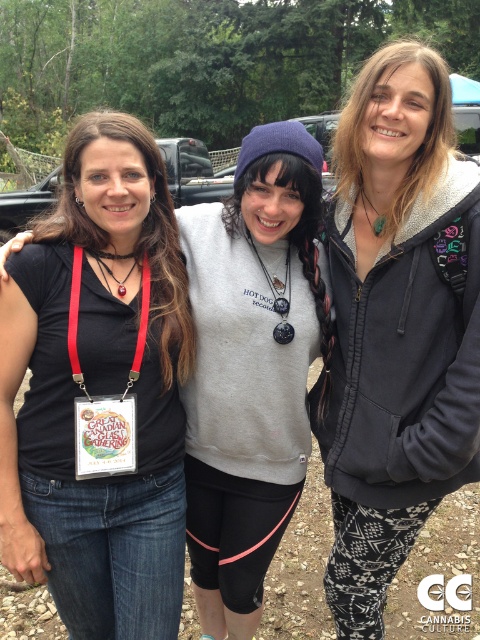
Question: Does black matte t-shirt at center have a greater width compared to red fabric lanyard at center?

Choices:
 (A) no
 (B) yes

Answer: (B)

Question: Considering the real-world distances, which object is closest to the black fabric lanyard at center?

Choices:
 (A) matte red lanyard at center
 (B) red fabric lanyard at center

Answer: (A)

Question: Is black fabric lanyard at center to the left of green matte necklace at center from the viewer's perspective?

Choices:
 (A) no
 (B) yes

Answer: (B)

Question: Which point is closer to the camera?

Choices:
 (A) (343, 618)
 (B) (68, 340)
 (C) (368, 198)
 (D) (233, 348)

Answer: (B)

Question: Which object appears closest to the camera in this image?

Choices:
 (A) matte gray hoodie at center
 (B) green matte necklace at center

Answer: (A)

Question: Considering the relative positions of black fabric lanyard at center and green matte necklace at center in the image provided, where is black fabric lanyard at center located with respect to green matte necklace at center?

Choices:
 (A) above
 (B) below

Answer: (B)